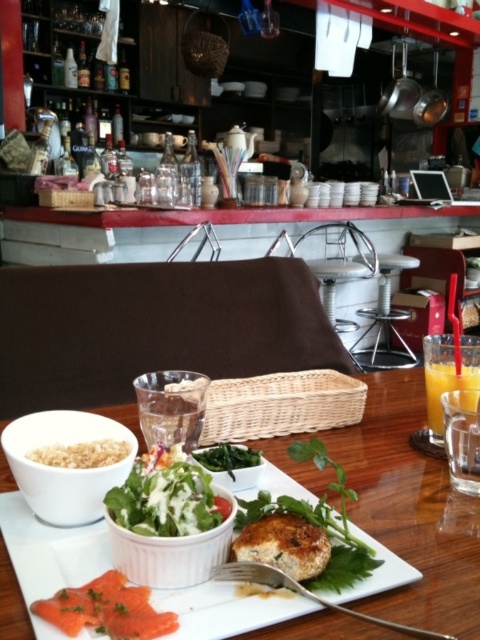
You are a food critic who just arrived at the table. You need to describe the size comparison between the white matte bowl at lower left and the brown crumbly at lower left. Which one is larger?

The white matte bowl at lower left is bigger than the brown crumbly at lower left.

You are a customer at a restaurant and want to reach for the white matte bowl at lower left. Based on its position, where should you look on the table to find it?

Result: The white matte bowl at lower left is located at the coordinates point (68,461) on the table, so you should look towards the lower left area of the table to find it.

You are a food critic evaluating the layout of this meal. Based on the placement of the green leafy salad at center and the pinkish salmon at lower left, which dish is placed higher on the plate?

The green leafy salad at center is positioned over the pinkish salmon at lower left, meaning it is placed higher on the plate.